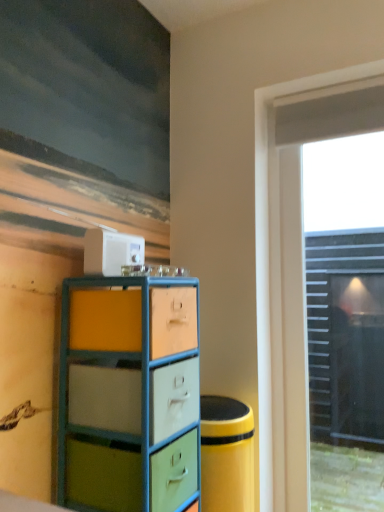
At what (x,y) coordinates should I click in order to perform the action: click on matte painted wood chest of drawers at center. Please return your answer as a coordinate pair (x, y). This screenshot has width=384, height=512. Looking at the image, I should click on (129, 394).

This screenshot has height=512, width=384. Find the location of `the chest of drawers that is below the white plastic toaster at upper center (from the image's perspective)`. the chest of drawers that is below the white plastic toaster at upper center (from the image's perspective) is located at coordinates (129, 394).

In the scene shown: Can you confirm if white plastic toaster at upper center is thinner than matte painted wood chest of drawers at center?

Correct, the width of white plastic toaster at upper center is less than that of matte painted wood chest of drawers at center.

Considering the relative sizes of white plastic toaster at upper center and matte painted wood chest of drawers at center in the image provided, is white plastic toaster at upper center bigger than matte painted wood chest of drawers at center?

No.

From a real-world perspective, which object stands above the other?

white plastic toaster at upper center, from a real-world perspective.

Considering the relative sizes of matte painted wood chest of drawers at center and white plastic toaster at upper center in the image provided, is matte painted wood chest of drawers at center wider than white plastic toaster at upper center?

Yes, matte painted wood chest of drawers at center is wider than white plastic toaster at upper center.

Which is in front, point (70, 357) or point (137, 250)?

The point (70, 357) is in front.

Consider the image. Can you confirm if matte painted wood chest of drawers at center is shorter than white plastic toaster at upper center?

Incorrect, the height of matte painted wood chest of drawers at center does not fall short of that of white plastic toaster at upper center.

From a real-world perspective, does transparent glass door at right sit lower than matte painted wood chest of drawers at center?

Incorrect, from a real-world perspective, transparent glass door at right is higher than matte painted wood chest of drawers at center.

At what (x,y) coordinates should I click in order to perform the action: click on the chest of drawers located underneath the transparent glass door at right (from a real-world perspective). Please return your answer as a coordinate pair (x, y). This screenshot has width=384, height=512. Looking at the image, I should click on (129, 394).

Is transparent glass door at right positioned with its back to matte painted wood chest of drawers at center?

No, matte painted wood chest of drawers at center is not at the back of transparent glass door at right.

From the picture: Between matte painted wood chest of drawers at center and transparent glass door at right, which one appears on the left side from the viewer's perspective?

Positioned to the left is matte painted wood chest of drawers at center.

Which of these two, matte painted wood chest of drawers at center or transparent glass door at right, is thinner?

With smaller width is transparent glass door at right.

Is matte painted wood chest of drawers at center touching transparent glass door at right?

No, matte painted wood chest of drawers at center is not beside transparent glass door at right.

Does matte painted wood chest of drawers at center turn towards transparent glass door at right?

No, matte painted wood chest of drawers at center is not turned towards transparent glass door at right.

Between white plastic toaster at upper center and transparent glass door at right, which one has smaller width?

With smaller width is white plastic toaster at upper center.

In the scene shown: Considering the relative sizes of white plastic toaster at upper center and transparent glass door at right in the image provided, is white plastic toaster at upper center taller than transparent glass door at right?

Incorrect, the height of white plastic toaster at upper center is not larger of that of transparent glass door at right.

Is white plastic toaster at upper center oriented away from transparent glass door at right?

That's not correct — white plastic toaster at upper center is not looking away from transparent glass door at right.

Consider the image. From their relative heights in the image, would you say transparent glass door at right is taller or shorter than white plastic toaster at upper center?

transparent glass door at right is taller than white plastic toaster at upper center.

Between transparent glass door at right and white plastic toaster at upper center, which one appears on the left side from the viewer's perspective?

white plastic toaster at upper center.

At what (x,y) coordinates should I click in order to perform the action: click on window below the white plastic toaster at upper center (from a real-world perspective). Please return your answer as a coordinate pair (x, y). The width and height of the screenshot is (384, 512). Looking at the image, I should click on (295, 270).

From a real-world perspective, relative to white plastic toaster at upper center, is transparent glass door at right vertically above or below?

transparent glass door at right is below white plastic toaster at upper center.

Find the location of `the chest of drawers that is below the white plastic toaster at upper center (from the image's perspective)`. the chest of drawers that is below the white plastic toaster at upper center (from the image's perspective) is located at coordinates (129, 394).

Find the location of a particular element. chest of drawers in front of the white plastic toaster at upper center is located at coordinates (129, 394).

Looking at the image, which one is located further to white plastic toaster at upper center, matte painted wood chest of drawers at center or transparent glass door at right?

transparent glass door at right is further to white plastic toaster at upper center.

When comparing their distances from matte painted wood chest of drawers at center, does transparent glass door at right or white plastic toaster at upper center seem further?

Among the two, transparent glass door at right is located further to matte painted wood chest of drawers at center.

When comparing their distances from white plastic toaster at upper center, does transparent glass door at right or matte painted wood chest of drawers at center seem closer?

matte painted wood chest of drawers at center is closer to white plastic toaster at upper center.

From the image, which object appears to be farther from transparent glass door at right, white plastic toaster at upper center or matte painted wood chest of drawers at center?

white plastic toaster at upper center is positioned further to the anchor transparent glass door at right.

From the image, which object appears to be farther from matte painted wood chest of drawers at center, white plastic toaster at upper center or transparent glass door at right?

transparent glass door at right is further to matte painted wood chest of drawers at center.

Considering their positions, is matte painted wood chest of drawers at center positioned further to transparent glass door at right than white plastic toaster at upper center?

white plastic toaster at upper center is further to transparent glass door at right.

Where is `chest of drawers between white plastic toaster at upper center and transparent glass door at right from left to right`? Image resolution: width=384 pixels, height=512 pixels. chest of drawers between white plastic toaster at upper center and transparent glass door at right from left to right is located at coordinates 129,394.